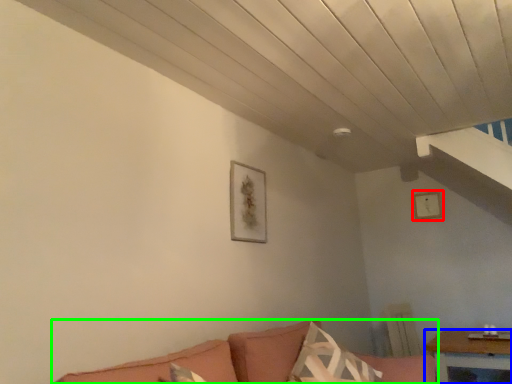
Question: Considering the real-world distances, which object is closest to picture frame (highlighted by a red box)? table (highlighted by a blue box) or studio couch (highlighted by a green box).

Choices:
 (A) table
 (B) studio couch

Answer: (A)